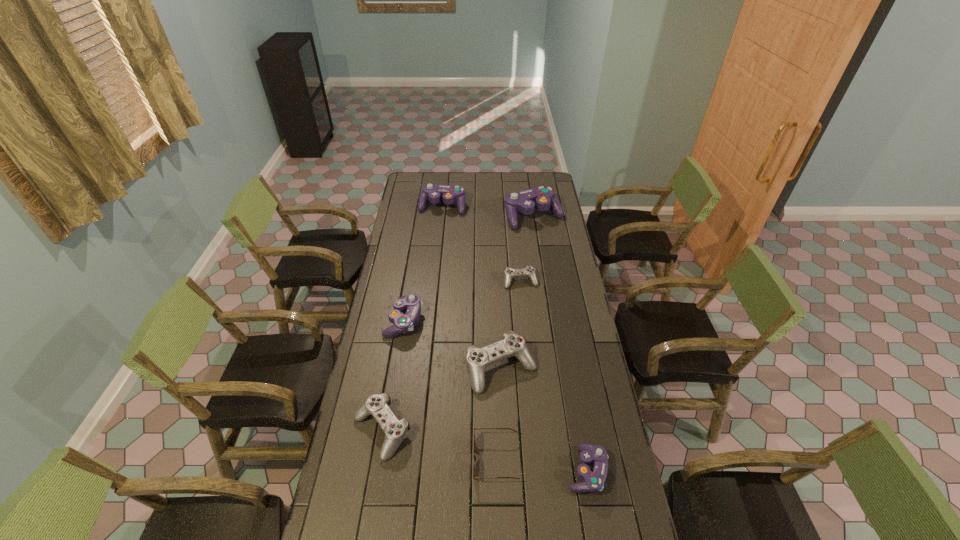
Image resolution: width=960 pixels, height=540 pixels. What are the coordinates of `free space located at the front view of the brown spectacles` in the screenshot? It's located at click(371, 460).

This screenshot has height=540, width=960. I want to click on vacant region located 0.340m at the front view of the brown spectacles, so click(x=371, y=460).

Where is `vacant space located 0.260m at the front view of the brown spectacles`? This screenshot has width=960, height=540. vacant space located 0.260m at the front view of the brown spectacles is located at coordinates (396, 460).

You are a GUI agent. You are given a task and a screenshot of the screen. Output one action in this format:
    pyautogui.click(x=<x>, y=<y>)
    Task: Click on the blank space located 0.050m on the back of the shortest control
    
    Given the screenshot: What is the action you would take?
    pyautogui.click(x=519, y=266)

In the image, there is a desktop. At what (x,y) coordinates should I click in order to perform the action: click on vacant space at the far edge. Please return your answer as a coordinate pair (x, y). The width and height of the screenshot is (960, 540). Looking at the image, I should click on (464, 184).

Locate an element on the screen. free region at the right edge of the desktop is located at coordinates (587, 317).

Identify the location of vacant region between the tallest object and the farthest white control. The height and width of the screenshot is (540, 960). point(527,249).

The image size is (960, 540). Find the location of `free point between the leftmost white control and the sixth nearest object`. free point between the leftmost white control and the sixth nearest object is located at coordinates (451, 356).

You are a GUI agent. You are given a task and a screenshot of the screen. Output one action in this format:
    pyautogui.click(x=<x>, y=<y>)
    Task: Click on the free space between the brown spectacles and the nearest white control
    
    Given the screenshot: What is the action you would take?
    pyautogui.click(x=439, y=446)

The width and height of the screenshot is (960, 540). I want to click on vacant space that is in between the second farthest white control and the nearest purple control, so click(x=544, y=420).